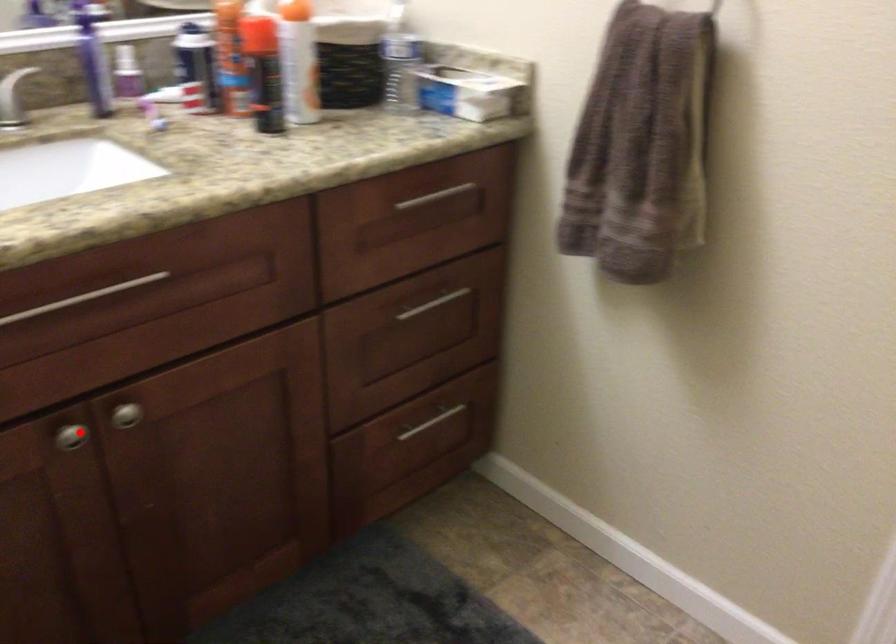
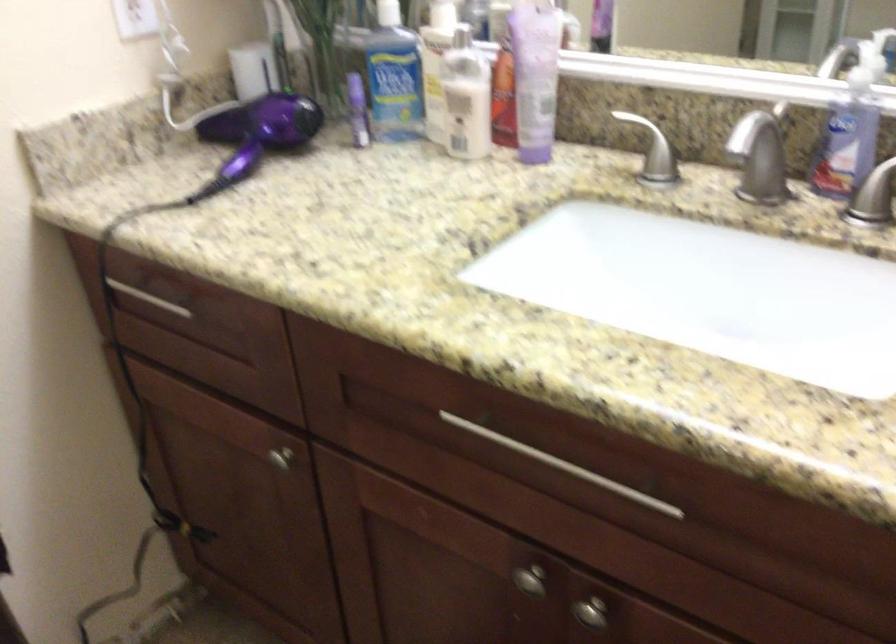
Locate, in the second image, the point that corresponds to the highlighted location in the first image.

(530, 580)